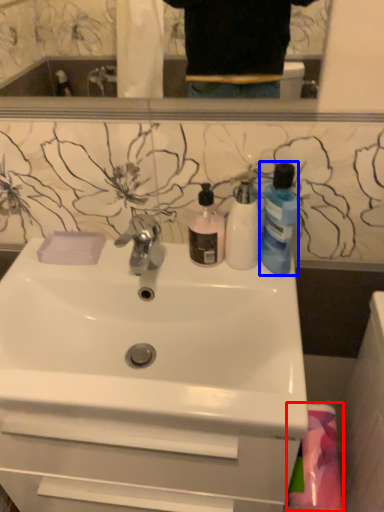
Question: Which point is further to the camera, material (highlighted by a red box) or cleaning product (highlighted by a blue box)?

Choices:
 (A) material
 (B) cleaning product

Answer: (A)